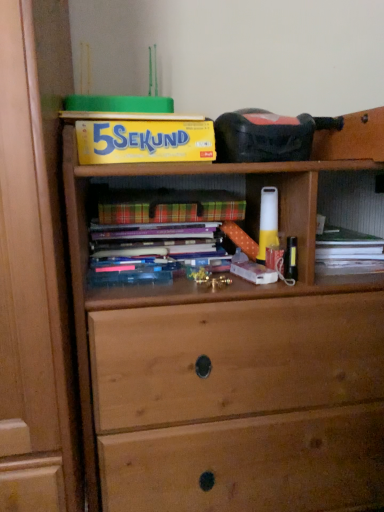
What do you see at coordinates (144, 140) in the screenshot?
I see `yellow cardboard box at upper center, acting as the 2th paperback book starting from the bottom` at bounding box center [144, 140].

The width and height of the screenshot is (384, 512). What do you see at coordinates (156, 232) in the screenshot?
I see `hardcover book at center` at bounding box center [156, 232].

This screenshot has height=512, width=384. What are the coordinates of `yellow cardboard box at upper center, which appears as the 1th paperback book when viewed from the top` in the screenshot? It's located at (144, 140).

Between point (204, 207) and point (162, 226), which one is positioned in front?

The point (162, 226) is more forward.

Is plaid paper at center, arranged as the second paperback book when viewed from the top, facing away from hardcover book at center?

plaid paper at center, arranged as the second paperback book when viewed from the top, does not have its back to hardcover book at center.

Which of these two, plaid paper at center, arranged as the 1th paperback book when ordered from the bottom, or hardcover book at center, is smaller?

hardcover book at center.

Is hardcover book at center outside of plaid paper at center, arranged as the second paperback book when viewed from the top?

Yes.

Visually, is hardcover book at center positioned to the left or to the right of plaid paper at center, arranged as the second paperback book when viewed from the top?

Clearly, hardcover book at center is on the left of plaid paper at center, arranged as the second paperback book when viewed from the top, in the image.

Could you tell me if hardcover book at center is turned towards plaid paper at center, arranged as the 1th paperback book when ordered from the bottom?

No.

Who is smaller, hardcover book at center or plaid paper at center, arranged as the second paperback book when viewed from the top?

With smaller size is hardcover book at center.

Does yellow cardboard box at upper center, acting as the 2th paperback book starting from the bottom, have a smaller size compared to plaid paper at center, arranged as the second paperback book when viewed from the top?

Incorrect, yellow cardboard box at upper center, acting as the 2th paperback book starting from the bottom, is not smaller in size than plaid paper at center, arranged as the second paperback book when viewed from the top.

From the image's perspective, is yellow cardboard box at upper center, which appears as the 1th paperback book when viewed from the top, over plaid paper at center, arranged as the second paperback book when viewed from the top?

Yes, from the image's perspective, yellow cardboard box at upper center, which appears as the 1th paperback book when viewed from the top, is on top of plaid paper at center, arranged as the second paperback book when viewed from the top.

Does yellow cardboard box at upper center, which appears as the 1th paperback book when viewed from the top, turn towards plaid paper at center, arranged as the 1th paperback book when ordered from the bottom?

No, yellow cardboard box at upper center, which appears as the 1th paperback book when viewed from the top, is not turned towards plaid paper at center, arranged as the 1th paperback book when ordered from the bottom.

The width and height of the screenshot is (384, 512). In order to click on paperback book on the right of yellow cardboard box at upper center, acting as the 2th paperback book starting from the bottom in this screenshot , I will do `click(171, 211)`.

Is yellow cardboard box at upper center, acting as the 2th paperback book starting from the bottom, bigger or smaller than hardcover book at center?

Considering their sizes, yellow cardboard box at upper center, acting as the 2th paperback book starting from the bottom, takes up more space than hardcover book at center.

Considering the points (81, 127) and (140, 228), which point is in front, point (81, 127) or point (140, 228)?

Positioned in front is point (81, 127).

Is the surface of yellow cardboard box at upper center, which appears as the 1th paperback book when viewed from the top, in direct contact with hardcover book at center?

yellow cardboard box at upper center, which appears as the 1th paperback book when viewed from the top, is not next to hardcover book at center, and they're not touching.

Which paperback book is the 2nd one when counting from the front of the hardcover book at center? Please provide its 2D coordinates.

[(144, 140)]

Can you confirm if plaid paper at center, arranged as the 1th paperback book when ordered from the bottom, is wider than yellow cardboard box at upper center, which appears as the 1th paperback book when viewed from the top?

No, plaid paper at center, arranged as the 1th paperback book when ordered from the bottom, is not wider than yellow cardboard box at upper center, which appears as the 1th paperback book when viewed from the top.

Can you see plaid paper at center, arranged as the 1th paperback book when ordered from the bottom, touching yellow cardboard box at upper center, acting as the 2th paperback book starting from the bottom?

There is a gap between plaid paper at center, arranged as the 1th paperback book when ordered from the bottom, and yellow cardboard box at upper center, acting as the 2th paperback book starting from the bottom.

Looking at this image, from the image's perspective, does plaid paper at center, arranged as the 1th paperback book when ordered from the bottom, appear higher than yellow cardboard box at upper center, which appears as the 1th paperback book when viewed from the top?

Actually, plaid paper at center, arranged as the 1th paperback book when ordered from the bottom, appears below yellow cardboard box at upper center, which appears as the 1th paperback book when viewed from the top, in the image.

Considering the sizes of plaid paper at center, arranged as the 1th paperback book when ordered from the bottom, and yellow cardboard box at upper center, which appears as the 1th paperback book when viewed from the top, in the image, is plaid paper at center, arranged as the 1th paperback book when ordered from the bottom, taller or shorter than yellow cardboard box at upper center, which appears as the 1th paperback book when viewed from the top,?

Considering their sizes, plaid paper at center, arranged as the 1th paperback book when ordered from the bottom, has less height than yellow cardboard box at upper center, which appears as the 1th paperback book when viewed from the top.

From the image's perspective, which one is positioned higher, hardcover book at center or yellow cardboard box at upper center, which appears as the 1th paperback book when viewed from the top?

From the image's view, yellow cardboard box at upper center, which appears as the 1th paperback book when viewed from the top, is above.

Is hardcover book at center not near yellow cardboard box at upper center, acting as the 2th paperback book starting from the bottom?

That's not correct — hardcover book at center is a little close to yellow cardboard box at upper center, acting as the 2th paperback book starting from the bottom.

Does hardcover book at center have a greater height compared to yellow cardboard box at upper center, acting as the 2th paperback book starting from the bottom?

Incorrect, the height of hardcover book at center is not larger of that of yellow cardboard box at upper center, acting as the 2th paperback book starting from the bottom.

Locate an element on the screen. book that is on the left side of plaid paper at center, arranged as the second paperback book when viewed from the top is located at coordinates (156, 232).

At what (x,y) coordinates should I click in order to perform the action: click on the 1st paperback book above the hardcover book at center (from the image's perspective). Please return your answer as a coordinate pair (x, y). This screenshot has height=512, width=384. Looking at the image, I should click on (171, 211).

Which object lies nearer to the anchor point plaid paper at center, arranged as the second paperback book when viewed from the top, yellow cardboard box at upper center, acting as the 2th paperback book starting from the bottom, or hardcover book at center?

hardcover book at center is closer to plaid paper at center, arranged as the second paperback book when viewed from the top.

When comparing their distances from yellow cardboard box at upper center, which appears as the 1th paperback book when viewed from the top, does plaid paper at center, arranged as the second paperback book when viewed from the top, or hardcover book at center seem further?

hardcover book at center is further to yellow cardboard box at upper center, which appears as the 1th paperback book when viewed from the top.

When comparing their distances from hardcover book at center, does plaid paper at center, arranged as the 1th paperback book when ordered from the bottom, or yellow cardboard box at upper center, which appears as the 1th paperback book when viewed from the top, seem closer?

The object closer to hardcover book at center is plaid paper at center, arranged as the 1th paperback book when ordered from the bottom.

Estimate the real-world distances between objects in this image. Which object is closer to hardcover book at center, yellow cardboard box at upper center, acting as the 2th paperback book starting from the bottom, or plaid paper at center, arranged as the second paperback book when viewed from the top?

plaid paper at center, arranged as the second paperback book when viewed from the top, lies closer to hardcover book at center than the other object.

Which object lies further to the anchor point yellow cardboard box at upper center, which appears as the 1th paperback book when viewed from the top, hardcover book at center or plaid paper at center, arranged as the 1th paperback book when ordered from the bottom?

hardcover book at center lies further to yellow cardboard box at upper center, which appears as the 1th paperback book when viewed from the top, than the other object.

When comparing their distances from plaid paper at center, arranged as the 1th paperback book when ordered from the bottom, does hardcover book at center or yellow cardboard box at upper center, acting as the 2th paperback book starting from the bottom, seem closer?

Among the two, hardcover book at center is located nearer to plaid paper at center, arranged as the 1th paperback book when ordered from the bottom.

This screenshot has width=384, height=512. Find the location of `paperback book between yellow cardboard box at upper center, acting as the 2th paperback book starting from the bottom, and hardcover book at center from top to bottom`. paperback book between yellow cardboard box at upper center, acting as the 2th paperback book starting from the bottom, and hardcover book at center from top to bottom is located at coordinates (171, 211).